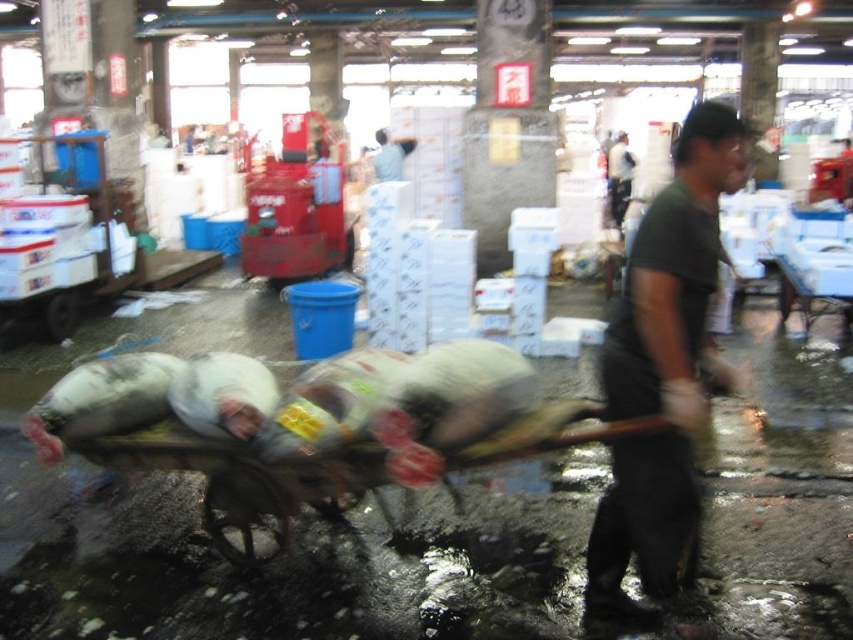
Does dark green shirt at center have a smaller size compared to light blue shirt at center?

Yes.

Who is lower down, dark green shirt at center or light blue shirt at center?

Positioned lower is dark green shirt at center.

Is point (614, 211) positioned in front of point (407, 150)?

No, it is not.

Find the location of a particular element. The height and width of the screenshot is (640, 853). dark green shirt at center is located at coordinates (619, 177).

Is metallic cart at center to the left of light blue shirt at center from the viewer's perspective?

Incorrect, metallic cart at center is not on the left side of light blue shirt at center.

Is metallic cart at center taller than light blue shirt at center?

No.

Between point (192, 433) and point (409, 138), which one is positioned behind?

The point (409, 138) is behind.

Where is `metallic cart at center`? metallic cart at center is located at coordinates (335, 467).

At what (x,y) coordinates should I click in order to perform the action: click on dark green t-shirt at center. Please return your answer as a coordinate pair (x, y). Image resolution: width=853 pixels, height=640 pixels. Looking at the image, I should click on (664, 371).

Can you confirm if dark green t-shirt at center is smaller than light blue shirt at center?

Yes, dark green t-shirt at center is smaller than light blue shirt at center.

Identify the location of dark green t-shirt at center. (664, 371).

The height and width of the screenshot is (640, 853). Find the location of `dark green t-shirt at center`. dark green t-shirt at center is located at coordinates (664, 371).